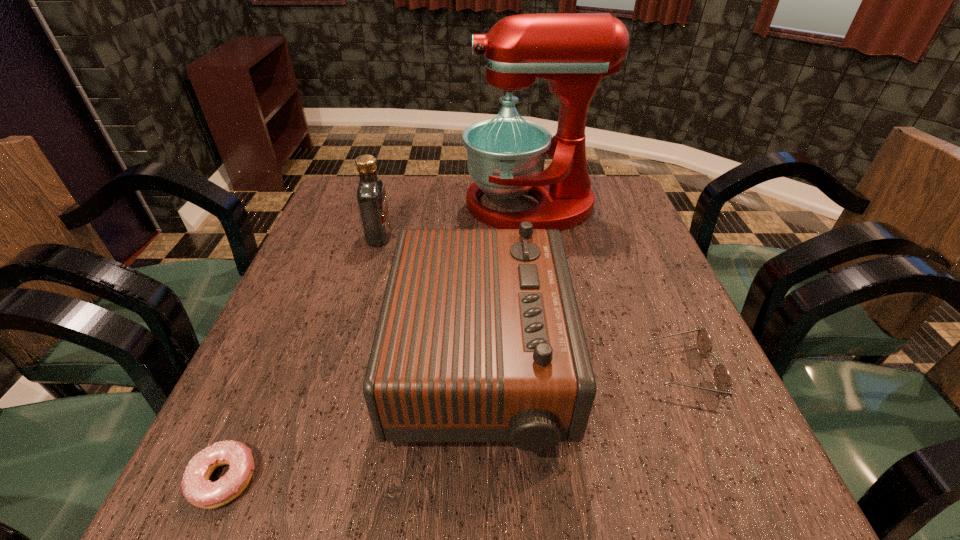
Where is `mixer at the right edge`? The height and width of the screenshot is (540, 960). mixer at the right edge is located at coordinates (572, 51).

In order to click on spectacles that is positioned at the right edge in this screenshot , I will do `click(722, 380)`.

The height and width of the screenshot is (540, 960). Identify the location of object at the near left corner. pyautogui.click(x=197, y=488).

Locate an element on the screen. object present at the far right corner is located at coordinates (572, 51).

Where is `free region at the far edge of the desktop`? free region at the far edge of the desktop is located at coordinates (456, 177).

In the image, there is a desktop. In order to click on free region at the near edge in this screenshot , I will do `click(416, 507)`.

At what (x,y) coordinates should I click in order to perform the action: click on vacant space at the left edge. Please return your answer as a coordinate pair (x, y). This screenshot has width=960, height=540. Looking at the image, I should click on (323, 239).

The width and height of the screenshot is (960, 540). I want to click on vacant region at the right edge of the desktop, so click(675, 308).

In the image, there is a desktop. Where is `free space at the far left corner`? This screenshot has height=540, width=960. free space at the far left corner is located at coordinates (343, 214).

In the image, there is a desktop. Where is `vacant space at the near left corner`? The width and height of the screenshot is (960, 540). vacant space at the near left corner is located at coordinates (288, 499).